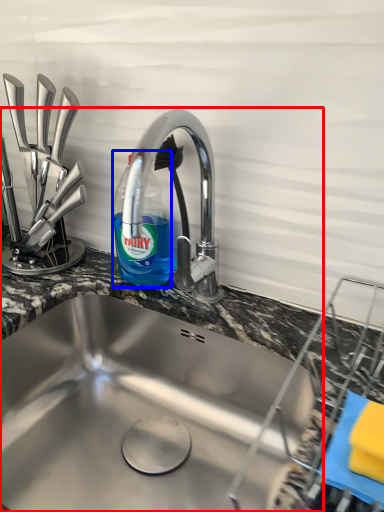
Question: Which point is closer to the camera, sink (highlighted by a red box) or bottle (highlighted by a blue box)?

Choices:
 (A) sink
 (B) bottle

Answer: (A)